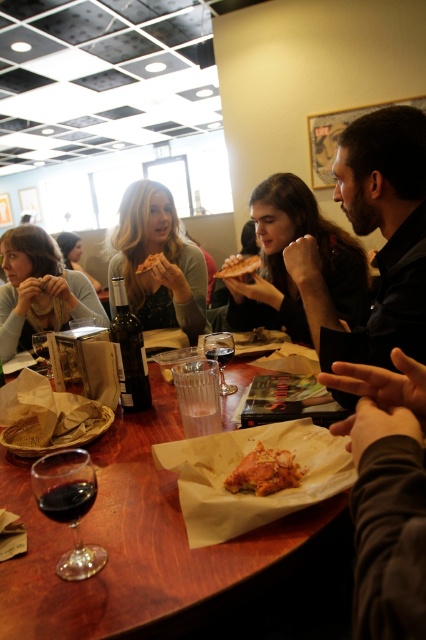
Between golden crispy chicken at center and blonde hair at upper left, which one appears on the left side from the viewer's perspective?

From the viewer's perspective, blonde hair at upper left appears more on the left side.

Which is behind, point (253, 451) or point (77, 253)?

The point (77, 253) is more distant.

Describe the element at coordinates (264, 472) in the screenshot. This screenshot has width=426, height=640. I see `golden crispy chicken at center` at that location.

This screenshot has height=640, width=426. Identify the location of golden crispy chicken at center. (264, 472).

Who is more forward, (402, 369) or (155, 193)?

Positioned in front is point (402, 369).

The width and height of the screenshot is (426, 640). I want to click on dark gray fabric hand at lower right, so click(x=386, y=496).

Find the location of a particular element. The width and height of the screenshot is (426, 640). dark gray fabric hand at lower right is located at coordinates (386, 496).

Between wooden table at center and blonde hair at upper left, which one has more height?

blonde hair at upper left

Can you confirm if wooden table at center is bigger than blonde hair at upper left?

No, wooden table at center is not bigger than blonde hair at upper left.

Does point (244, 557) come behind point (74, 253)?

No.

Image resolution: width=426 pixels, height=640 pixels. In order to click on wooden table at center in this screenshot , I will do `click(163, 552)`.